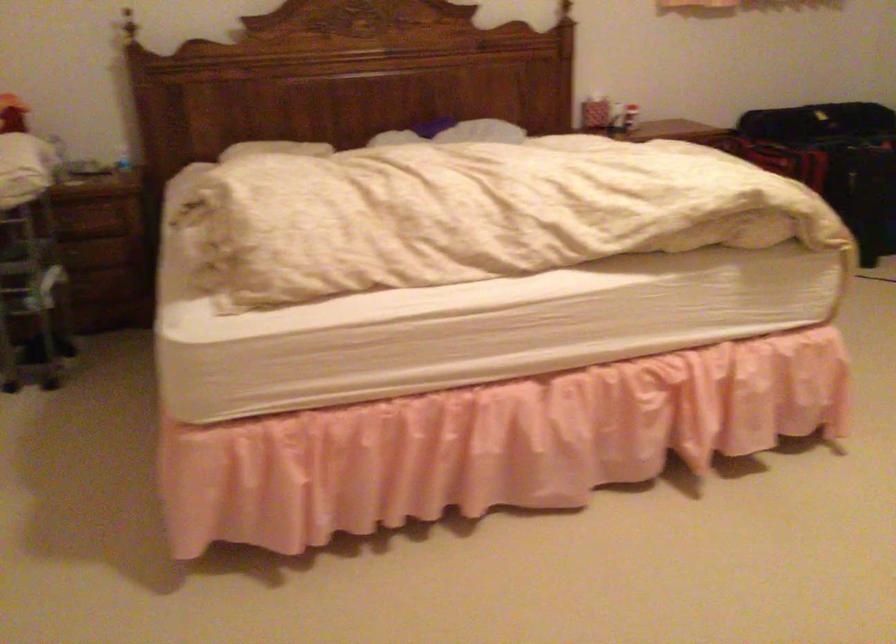
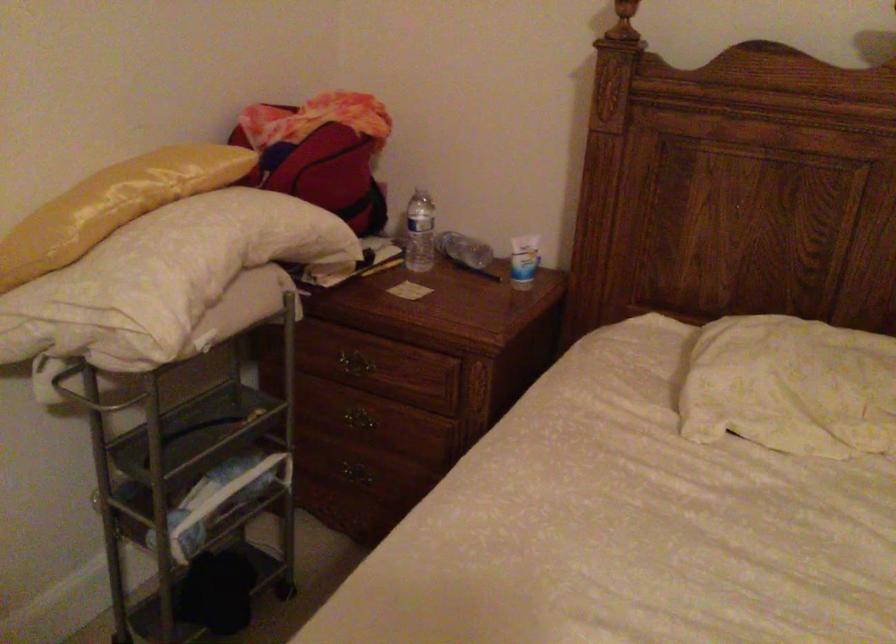
Where in the second image is the point corresponding to the point at 79,278 from the first image?

(355, 473)